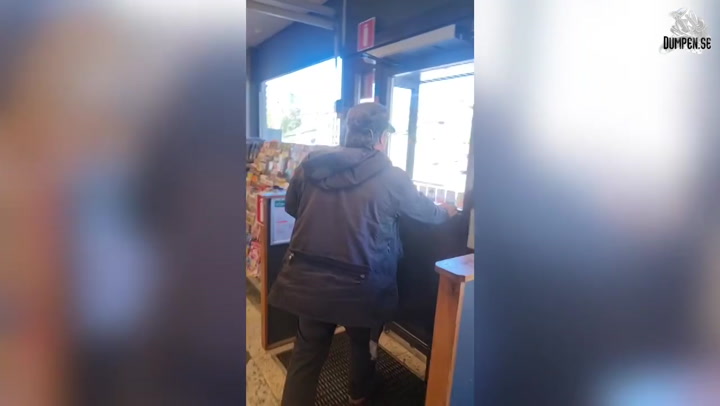
Locate an element on the screen. wooden parts is located at coordinates (445, 323), (264, 261).